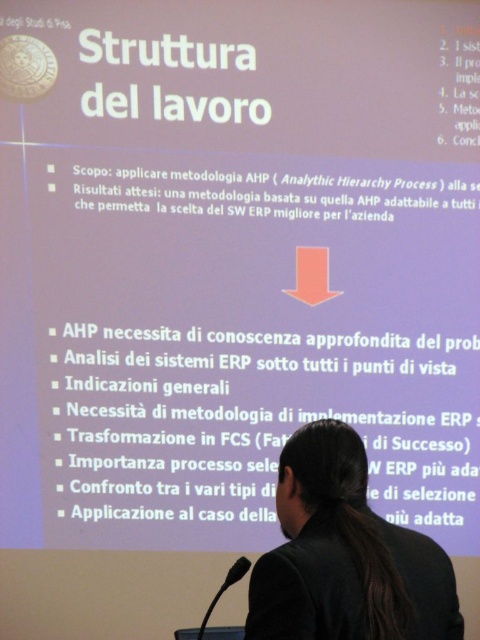
Which is behind, point (323, 525) or point (235, 582)?

The point (235, 582) is more distant.

What do you see at coordinates (345, 556) in the screenshot? This screenshot has width=480, height=640. I see `black hair at center` at bounding box center [345, 556].

At what (x,y) coordinates should I click in order to perform the action: click on black hair at center. Please return your answer as a coordinate pair (x, y). This screenshot has width=480, height=640. Looking at the image, I should click on (345, 556).